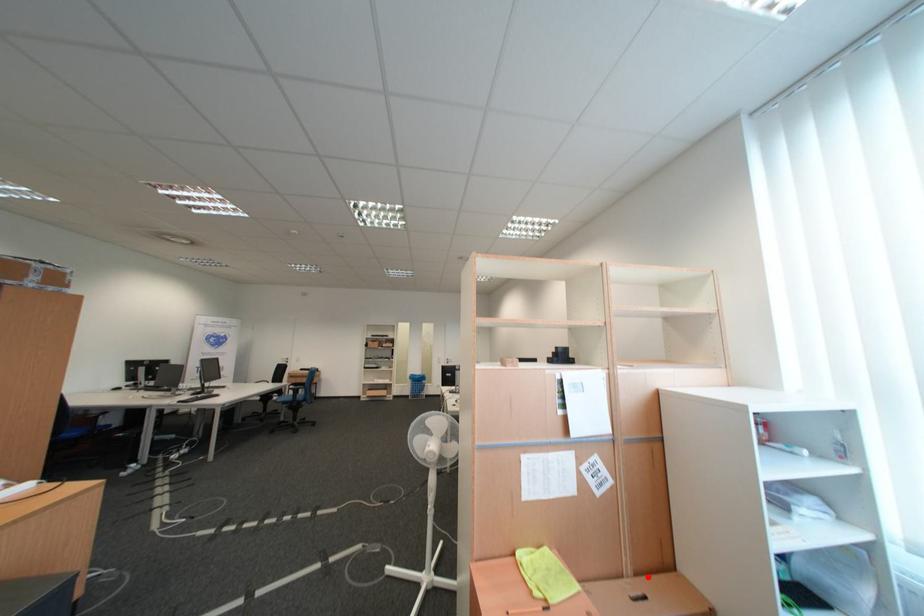
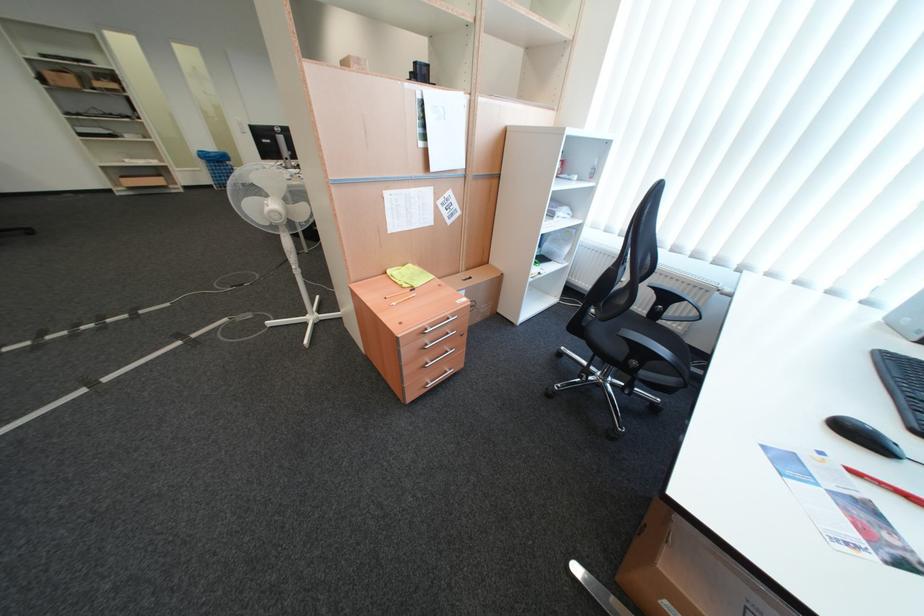
Where in the second image is the point corresponding to the highlighted location from the first image?

(479, 272)